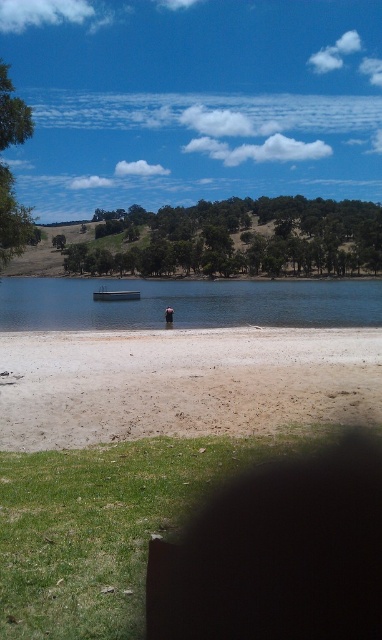
You are standing at the shore of the lake and see two points marked in the image. Which point is closer to you, point (215,296) or point (121,298)?

Point (215,296) is further to the camera than point (121,298), so point (121,298) is closer to you.

You are standing on the brown sandy beach at lower center and want to walk to the green leafy tree at left. Which direction should you head?

You should head to the left because the brown sandy beach at lower center is positioned on the right side of green leafy tree at left, meaning the tree is to your left.